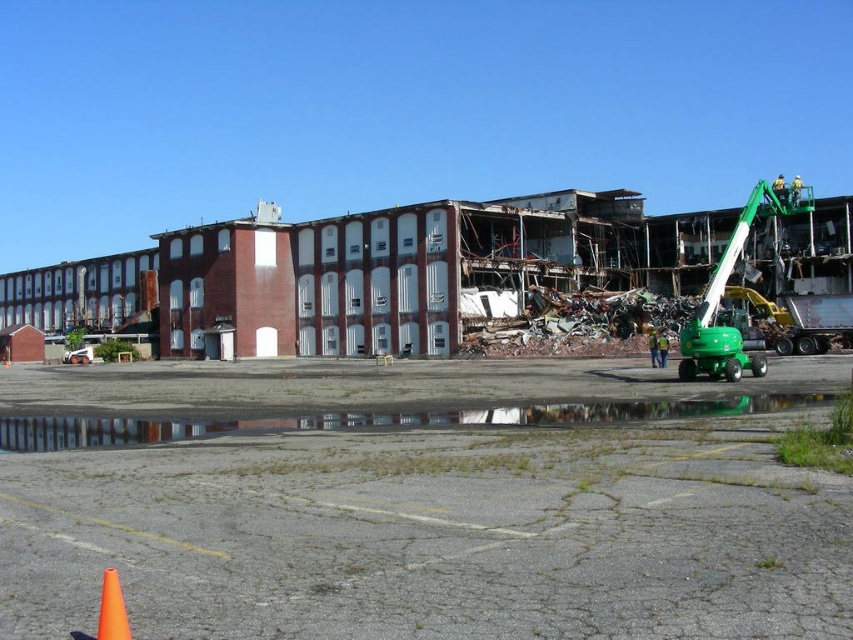
Can you confirm if rusty metal debris at center is wider than green rubber excavator at right?

No, rusty metal debris at center is not wider than green rubber excavator at right.

Is rusty metal debris at center to the left of green rubber excavator at right from the viewer's perspective?

Correct, you'll find rusty metal debris at center to the left of green rubber excavator at right.

Image resolution: width=853 pixels, height=640 pixels. I want to click on rusty metal debris at center, so click(x=369, y=273).

Which is more to the right, reflective concrete puddle at lower center or orange plastic traffic cone at lower left?

reflective concrete puddle at lower center

From the picture: Who is more forward, (770, 404) or (100, 596)?

Point (100, 596) is in front.

Does point (39, 433) come closer to viewer compared to point (115, 596)?

No, it is not.

Identify the location of reflective concrete puddle at lower center. This screenshot has width=853, height=640. (370, 420).

Can you confirm if green rubber tractor at center is thinner than green rubber excavator at right?

Yes, green rubber tractor at center is thinner than green rubber excavator at right.

In the scene shown: Between green rubber tractor at center and green rubber excavator at right, which one appears on the right side from the viewer's perspective?

green rubber excavator at right

Who is more distant from viewer, [668,426] or [712,284]?

Point [712,284]

The height and width of the screenshot is (640, 853). I want to click on green rubber tractor at center, so click(424, 506).